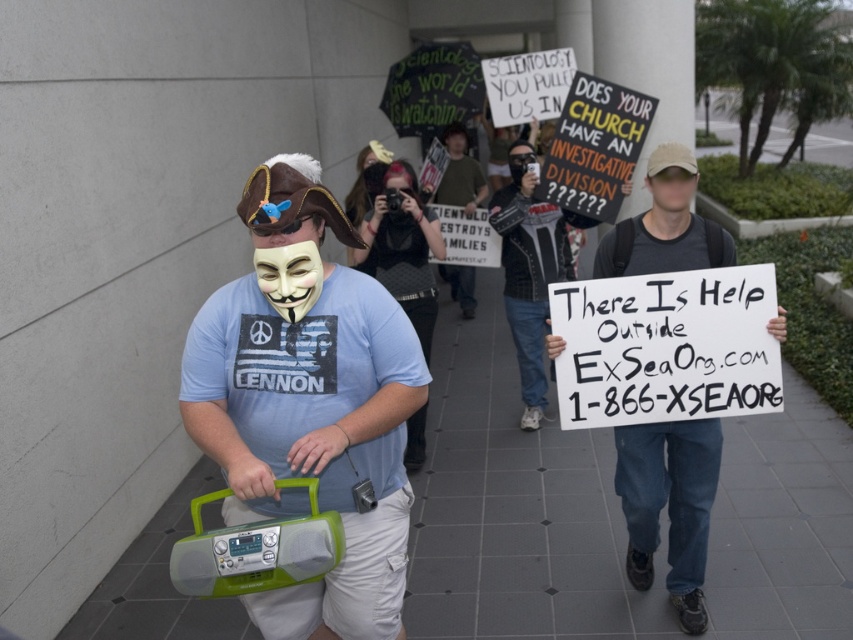
Question: Does green plastic boombox at center appear over white paper sign at center?

Choices:
 (A) no
 (B) yes

Answer: (B)

Question: Which point appears closest to the camera in this image?

Choices:
 (A) (675, 444)
 (B) (311, 230)

Answer: (B)

Question: Can you confirm if green plastic boombox at center is positioned above white paper sign at center?

Choices:
 (A) no
 (B) yes

Answer: (B)

Question: Is green plastic boombox at center closer to camera compared to white paper sign at center?

Choices:
 (A) no
 (B) yes

Answer: (B)

Question: Which point is farther from the camera taking this photo?

Choices:
 (A) (293, 512)
 (B) (653, 243)

Answer: (B)

Question: Among these objects, which one is farthest from the camera?

Choices:
 (A) green plastic boombox at center
 (B) white paper sign at center

Answer: (B)